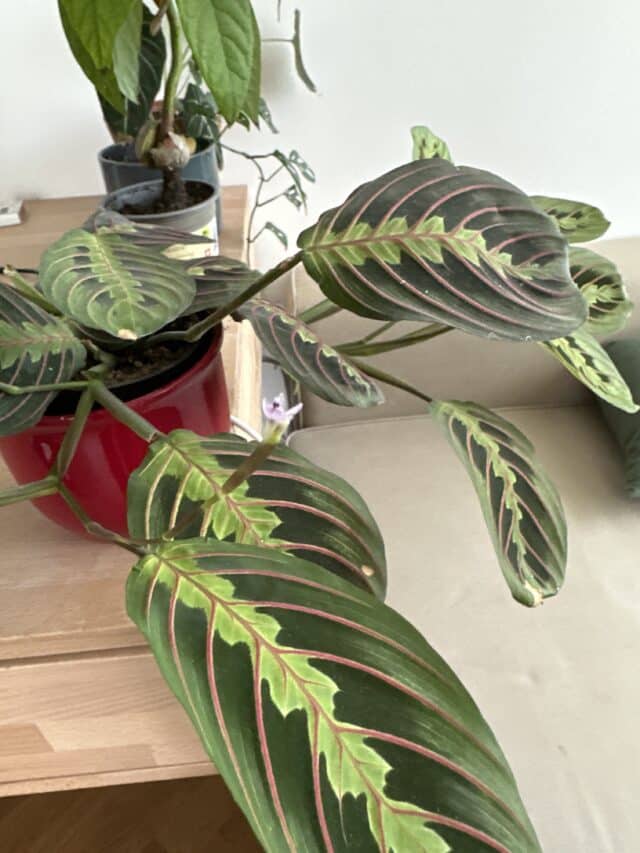
This screenshot has width=640, height=853. What are the coordinates of `wall` in the screenshot? It's located at (367, 64).